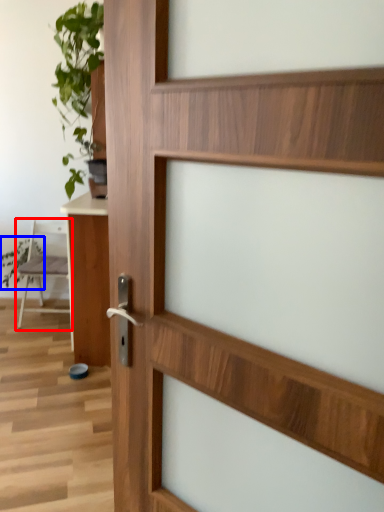
Question: Which point is closer to the camera, chair (highlighted by a red box) or plant (highlighted by a blue box)?

Choices:
 (A) chair
 (B) plant

Answer: (A)